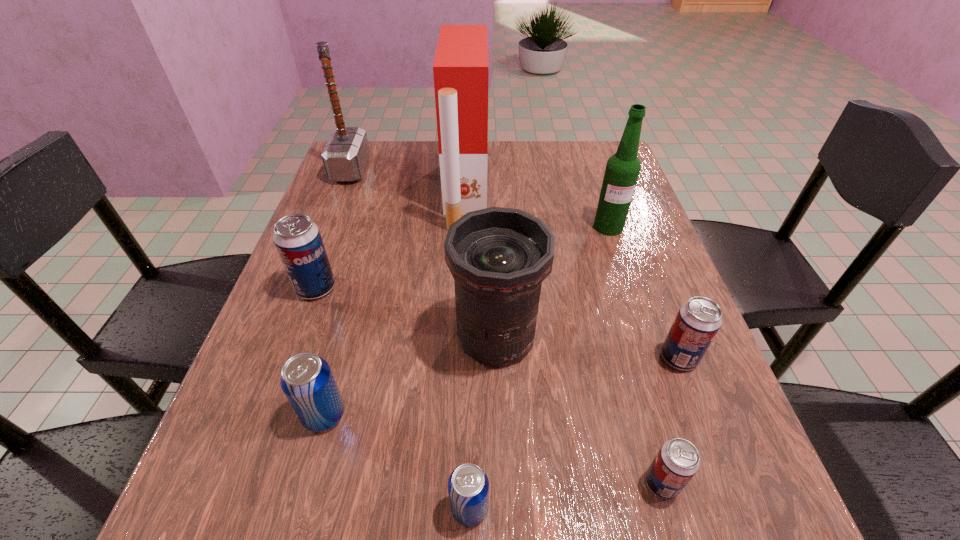
In order to click on red cigarette case in this screenshot , I will do `click(461, 69)`.

The width and height of the screenshot is (960, 540). Identify the location of brown hammer. (345, 156).

Where is `green beer bottle`? Image resolution: width=960 pixels, height=540 pixels. green beer bottle is located at coordinates (622, 170).

Where is `the fourth tallest object`? The width and height of the screenshot is (960, 540). the fourth tallest object is located at coordinates (499, 257).

Where is `the biggest red beer can`? The height and width of the screenshot is (540, 960). the biggest red beer can is located at coordinates (x=298, y=241).

This screenshot has width=960, height=540. I want to click on the farthest beer can, so coord(298,241).

You are a GUI agent. You are given a task and a screenshot of the screen. Output one action in this format:
    pyautogui.click(x=<x>, y=<y>)
    Task: Click on the rightmost beer can
    This screenshot has width=960, height=540.
    Given the screenshot: What is the action you would take?
    (698, 320)

Locate an element on the screen. the rightmost red beer can is located at coordinates (698, 320).

Identify the location of the third farthest beer can. (307, 381).

Image resolution: width=960 pixels, height=540 pixels. I want to click on the bigger blue beer can, so click(307, 381).